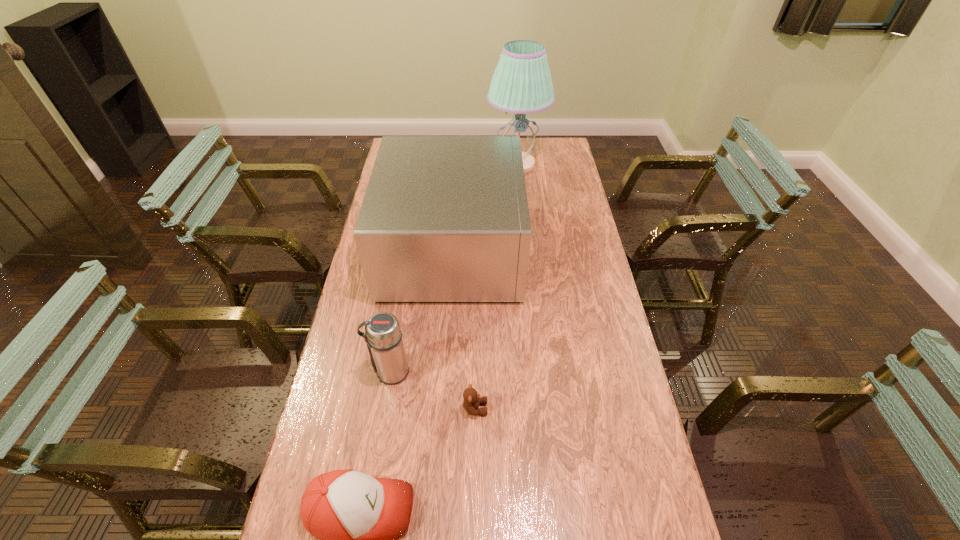
Where is `the farthest object`? the farthest object is located at coordinates (521, 84).

At what (x,y) coordinates should I click in order to perform the action: click on the tallest object. Please return your answer as a coordinate pair (x, y). The height and width of the screenshot is (540, 960). Looking at the image, I should click on (521, 84).

Locate an element on the screen. microwave oven is located at coordinates (444, 218).

Where is `the second farthest object`? Image resolution: width=960 pixels, height=540 pixels. the second farthest object is located at coordinates (444, 218).

Find the location of a particular element. The height and width of the screenshot is (540, 960). the third tallest object is located at coordinates (383, 336).

Identify the location of the third nearest object. (383, 336).

Identify the location of the shortest object. The width and height of the screenshot is (960, 540). (471, 402).

The image size is (960, 540). Identify the location of teddy bear. (471, 402).

Identify the location of vacant region located 0.160m on the front of the farthest object. The image size is (960, 540). (520, 205).

Locate an element on the screen. This screenshot has width=960, height=540. blank space located with the door open on the microwave oven is located at coordinates (580, 249).